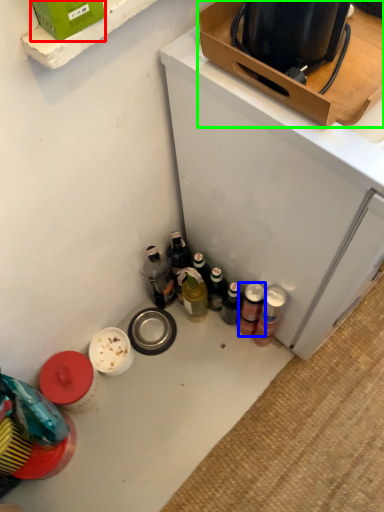
Question: Which is nearer to the box (highlighted by a red box)? beverage (highlighted by a blue box) or box (highlighted by a green box).

Choices:
 (A) beverage
 (B) box

Answer: (B)